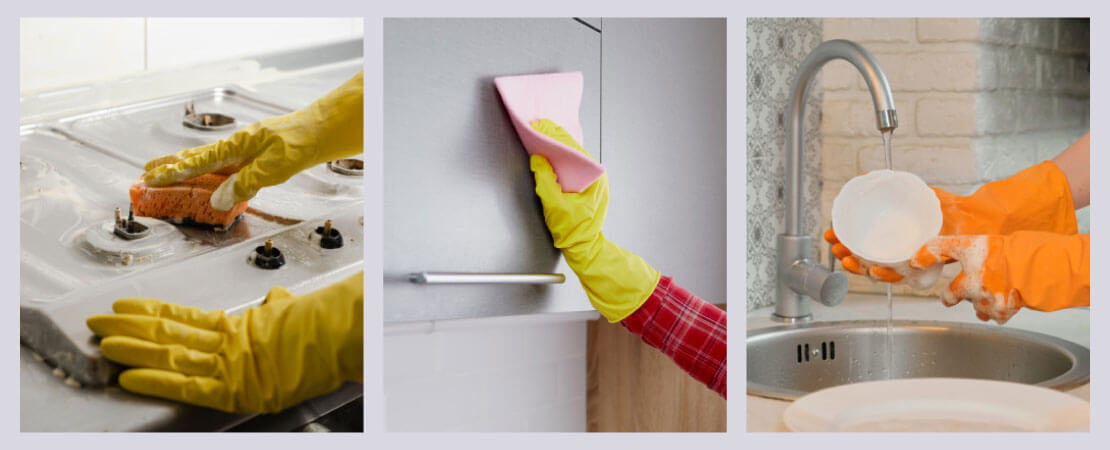
Identify the location of right range top. Image resolution: width=1110 pixels, height=450 pixels. (140, 138).